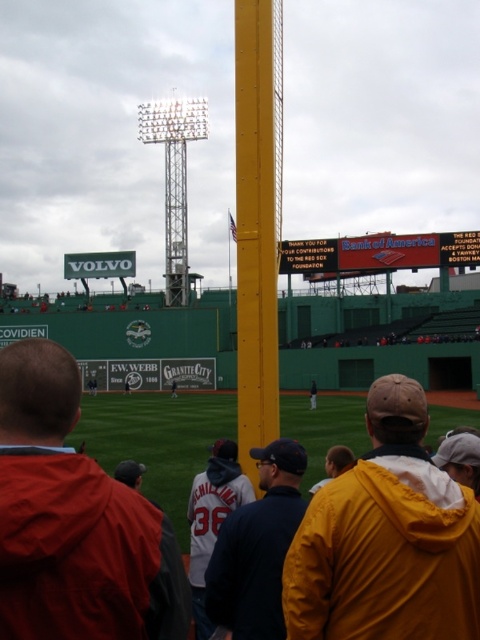
You are a photographer trying to capture a clear shot of the yellow painted metal pole at center. There is a person wearing a yellow hooded jacket at center in the way. Can you estimate if the jacket is blocking the pole completely?

The yellow hooded jacket at center might be wider than yellow painted metal pole at center, so there is a possibility that the jacket is blocking the pole completely.

Consider the image. You are a photographer trying to capture a wide shot of the baseball stadium. You notice the yellow hooded jacket at center and the red plastic scoreboard at center in your frame. Which object appears narrower in the photo?

The yellow hooded jacket at center appears narrower than the red plastic scoreboard at center because the yellow hooded jacket at center is thinner than the red plastic scoreboard at center.

You are a photographer standing at the edge of the baseball field. You want to take a photo that includes both the orange hooded jacket at lower left and the red plastic scoreboard at center. However, you notice that one of them might be partially blocked by the yellow pole in the center. Based on their heights, which object is more likely to be visible in the photo?

The orange hooded jacket at lower left has a greater height compared to the red plastic scoreboard at center. Since the jacket is taller, it is more likely to be visible above the yellow pole, while the scoreboard might be partially blocked if it is shorter and positioned behind the pole.